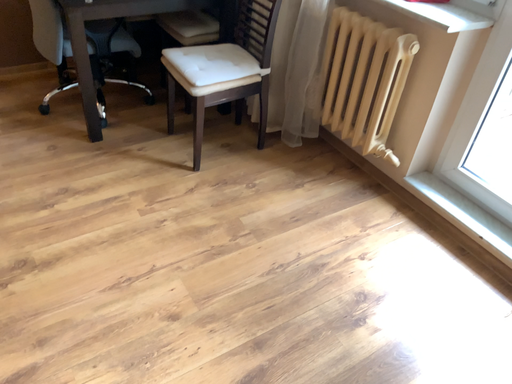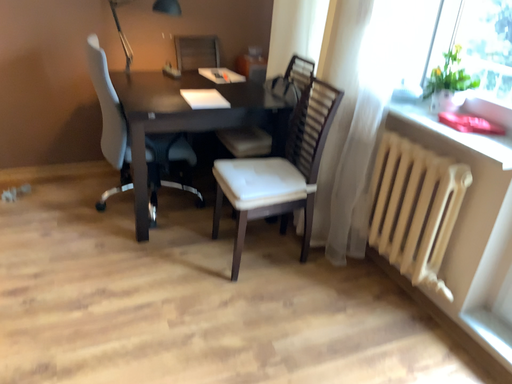
Question: Which way did the camera rotate in the video?

Choices:
 (A) rotated downward
 (B) rotated upward

Answer: (B)